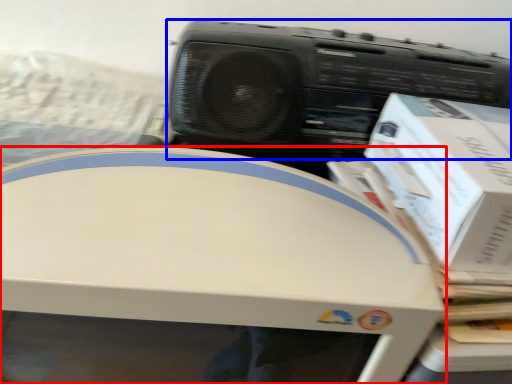
Question: Among these objects, which one is farthest to the camera, home appliance (highlighted by a red box) or cassette (highlighted by a blue box)?

Choices:
 (A) home appliance
 (B) cassette

Answer: (B)